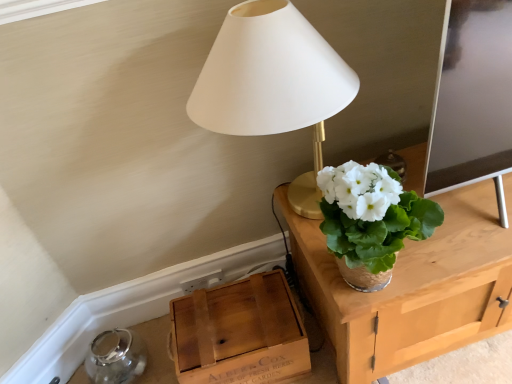
Question: Is wooden crate at lower left at the left side of woven straw vase at upper right?

Choices:
 (A) yes
 (B) no

Answer: (A)

Question: Is wooden crate at lower left far from woven straw vase at upper right?

Choices:
 (A) no
 (B) yes

Answer: (A)

Question: Could you tell me if wooden crate at lower left is facing woven straw vase at upper right?

Choices:
 (A) no
 (B) yes

Answer: (A)

Question: Considering the relative sizes of wooden crate at lower left and woven straw vase at upper right in the image provided, is wooden crate at lower left taller than woven straw vase at upper right?

Choices:
 (A) no
 (B) yes

Answer: (A)

Question: From the image's perspective, is wooden crate at lower left on top of woven straw vase at upper right?

Choices:
 (A) no
 (B) yes

Answer: (A)

Question: From a real-world perspective, is wooden crate at lower left on woven straw vase at upper right?

Choices:
 (A) no
 (B) yes

Answer: (A)

Question: Does woven straw vase at upper right have a smaller size compared to white matte lampshade at upper center?

Choices:
 (A) yes
 (B) no

Answer: (A)

Question: Is woven straw vase at upper right wider than white matte lampshade at upper center?

Choices:
 (A) yes
 (B) no

Answer: (B)

Question: From a real-world perspective, is woven straw vase at upper right on top of white matte lampshade at upper center?

Choices:
 (A) yes
 (B) no

Answer: (B)

Question: From a real-world perspective, is woven straw vase at upper right under white matte lampshade at upper center?

Choices:
 (A) no
 (B) yes

Answer: (B)

Question: Are woven straw vase at upper right and white matte lampshade at upper center located far from each other?

Choices:
 (A) no
 (B) yes

Answer: (A)

Question: From the image's perspective, is woven straw vase at upper right under white matte lampshade at upper center?

Choices:
 (A) yes
 (B) no

Answer: (A)

Question: Is white matte lampshade at upper center completely or partially inside wooden crate at lower left?

Choices:
 (A) no
 (B) yes

Answer: (A)